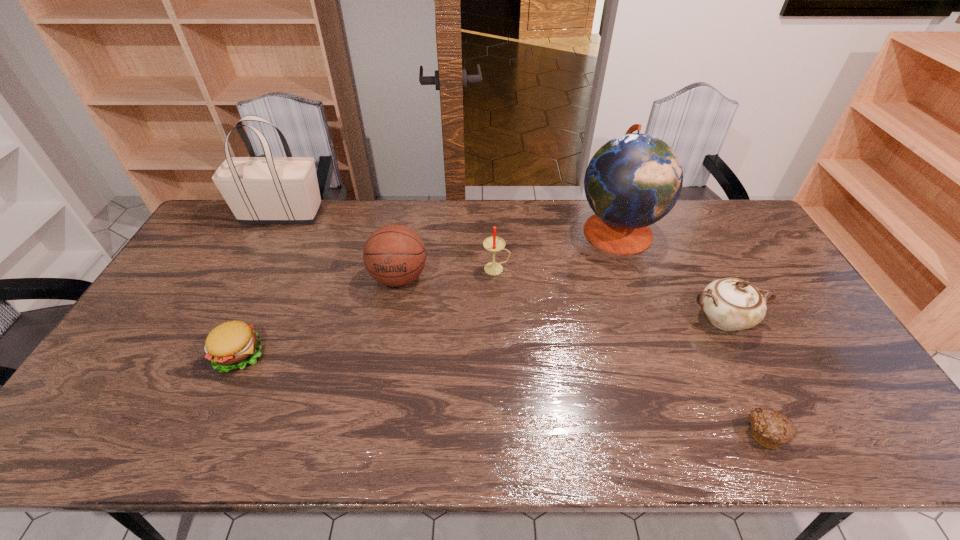
Find the location of `vacant space located with the Americas facing the viewer on the globe`. vacant space located with the Americas facing the viewer on the globe is located at coordinates (498, 230).

This screenshot has width=960, height=540. In order to click on vacant space located with handles facing forward on the shopping bag in this screenshot , I will do `click(393, 215)`.

Locate an element on the screen. vacant space located on the side with brand label of the basketball is located at coordinates (383, 364).

I want to click on blank space located on the right of the candle, so click(x=604, y=269).

This screenshot has width=960, height=540. Identify the location of blank area located on the left of the chinaware. (603, 319).

Find the location of `vacant space located on the left of the second shortest object`. vacant space located on the left of the second shortest object is located at coordinates (147, 355).

This screenshot has height=540, width=960. I want to click on free space located 0.270m on the back of the muffin, so click(x=714, y=326).

Locate an element on the screen. The image size is (960, 540). globe that is at the far edge is located at coordinates (634, 180).

Locate an element on the screen. This screenshot has width=960, height=540. shopping bag located at the far edge is located at coordinates (259, 190).

The width and height of the screenshot is (960, 540). What are the coordinates of `object that is at the near edge` in the screenshot? It's located at (770, 429).